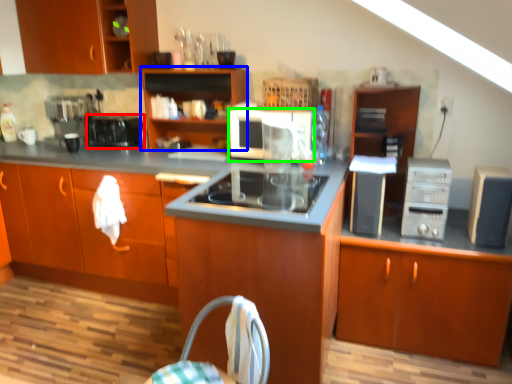
Question: Estimate the real-world distances between objects in this image. Which object is farther from kitchen appliance (highlighted by a red box), cabinetry (highlighted by a blue box) or kitchen appliance (highlighted by a green box)?

Choices:
 (A) cabinetry
 (B) kitchen appliance

Answer: (B)